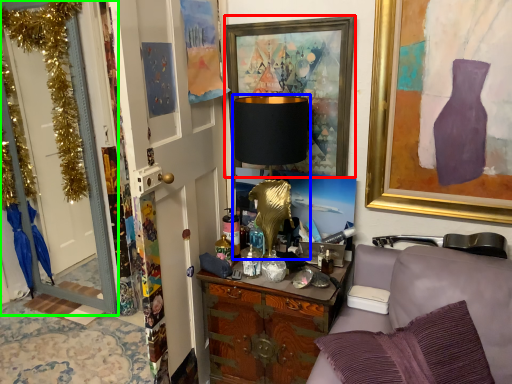
Question: Estimate the real-world distances between objects in this image. Which object is closer to picture frame (highlighted by a red box), table lamp (highlighted by a blue box) or door (highlighted by a green box)?

Choices:
 (A) table lamp
 (B) door

Answer: (A)